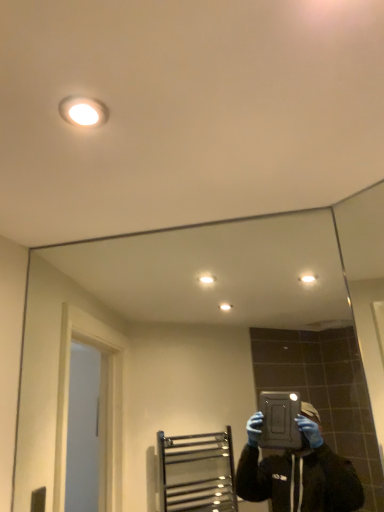
Question: Does clear glass mirror at center have a lesser width compared to white glossy light fixture at upper center?

Choices:
 (A) yes
 (B) no

Answer: (A)

Question: Can you confirm if clear glass mirror at center is smaller than white glossy light fixture at upper center?

Choices:
 (A) yes
 (B) no

Answer: (B)

Question: Can you confirm if clear glass mirror at center is taller than white glossy light fixture at upper center?

Choices:
 (A) no
 (B) yes

Answer: (B)

Question: Is clear glass mirror at center outside white glossy light fixture at upper center?

Choices:
 (A) no
 (B) yes

Answer: (B)

Question: Is clear glass mirror at center to the right of white glossy light fixture at upper center from the viewer's perspective?

Choices:
 (A) no
 (B) yes

Answer: (B)

Question: Can you see clear glass mirror at center touching white glossy light fixture at upper center?

Choices:
 (A) no
 (B) yes

Answer: (A)

Question: From the image's perspective, is white glossy light fixture at upper center below clear glass mirror at center?

Choices:
 (A) yes
 (B) no

Answer: (B)

Question: Is white glossy light fixture at upper center in contact with clear glass mirror at center?

Choices:
 (A) no
 (B) yes

Answer: (A)

Question: Does white glossy light fixture at upper center have a greater height compared to clear glass mirror at center?

Choices:
 (A) no
 (B) yes

Answer: (A)

Question: Is white glossy light fixture at upper center positioned beyond the bounds of clear glass mirror at center?

Choices:
 (A) yes
 (B) no

Answer: (A)

Question: Considering the relative positions of white glossy light fixture at upper center and clear glass mirror at center in the image provided, is white glossy light fixture at upper center to the right of clear glass mirror at center from the viewer's perspective?

Choices:
 (A) no
 (B) yes

Answer: (A)

Question: Is white glossy light fixture at upper center oriented towards clear glass mirror at center?

Choices:
 (A) yes
 (B) no

Answer: (B)

Question: Considering the positions of clear glass mirror at center and white glossy light fixture at upper center in the image, is clear glass mirror at center wider or thinner than white glossy light fixture at upper center?

Choices:
 (A) wide
 (B) thin

Answer: (B)